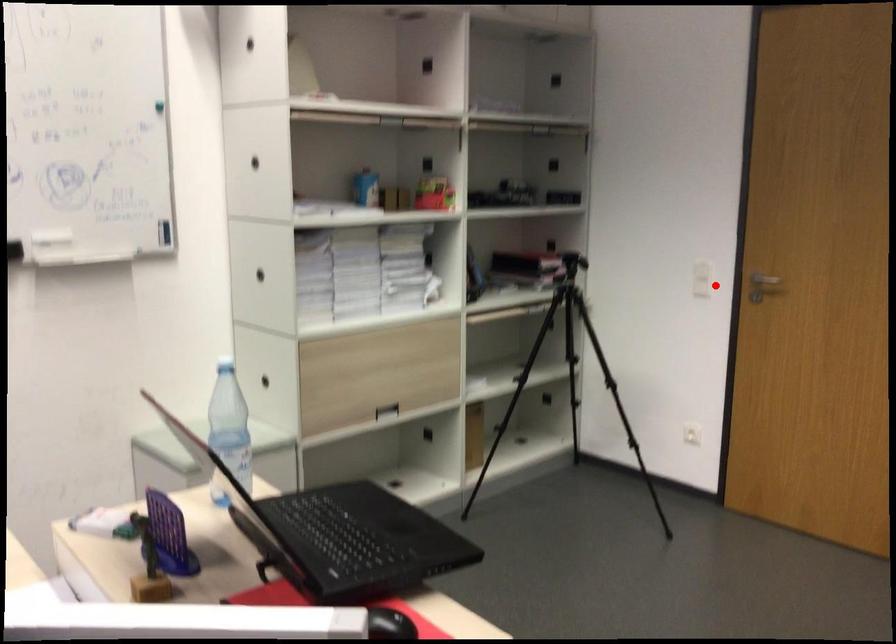
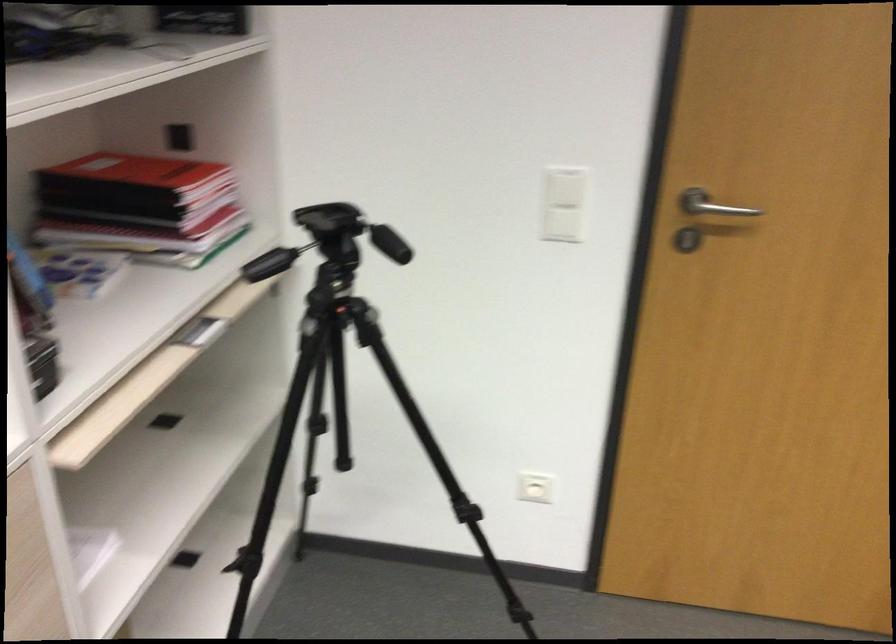
Question: I am providing you with two images of the same scene from different viewpoints. Given a red point in image1, look at the same physical point in image2. Is it:

Choices:
 (A) Closer to the viewpoint
 (B) Farther from the viewpoint

Answer: (A)